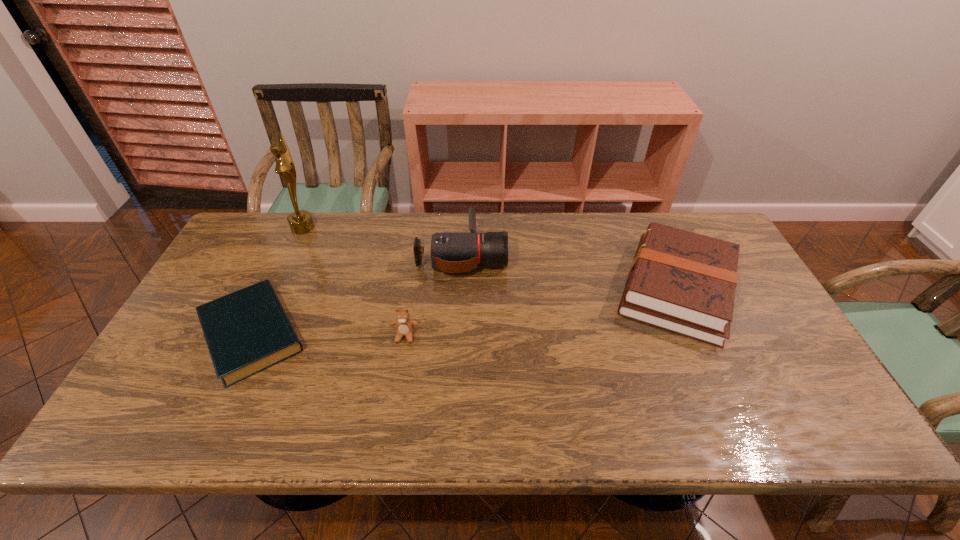
At what (x,y) coordinates should I click in order to perform the action: click on vacant region that satisfies the following two spatial constraints: 1. on the lens of the camcorder; 2. on the front-facing side of the teddy bear. Please return your answer as a coordinate pair (x, y). Looking at the image, I should click on (458, 336).

What are the coordinates of `vacant area in the image that satisfies the following two spatial constraints: 1. on the back side of the left book; 2. on the right side of the taller book` in the screenshot? It's located at (273, 289).